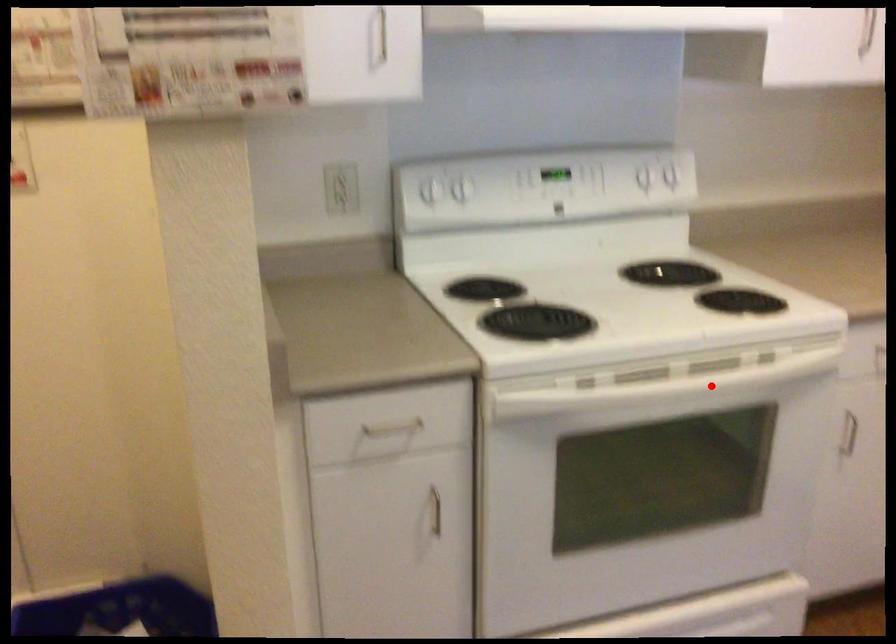
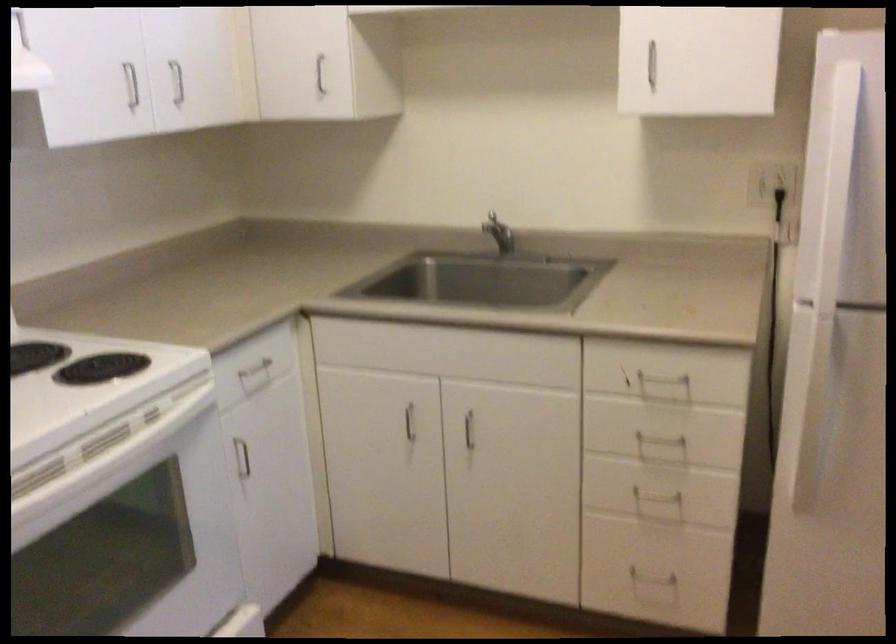
Find the pixel in the second image that matches the highlighted location in the first image.

(108, 459)